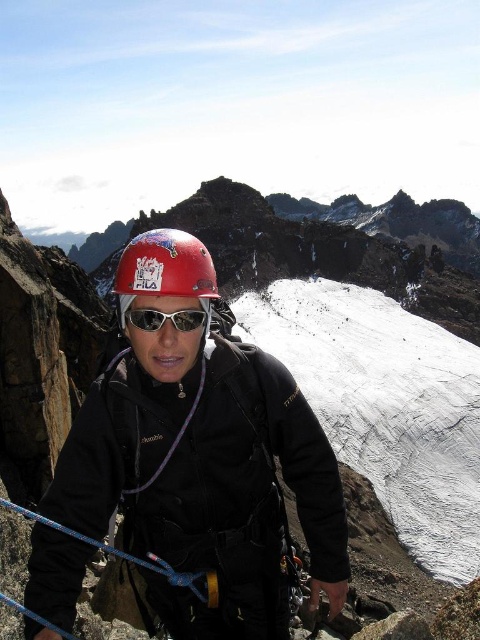
Question: Which object appears closest to the camera in this image?

Choices:
 (A) matte red helmet at center
 (B) blue synthetic rope at lower left

Answer: (B)

Question: Is matte black helmet at center positioned behind white reflective lens goggles at center?

Choices:
 (A) yes
 (B) no

Answer: (B)

Question: Is the position of matte black helmet at center less distant than that of blue synthetic rope at lower left?

Choices:
 (A) no
 (B) yes

Answer: (B)

Question: Is matte red helmet at center positioned before blue synthetic rope at lower left?

Choices:
 (A) no
 (B) yes

Answer: (A)

Question: Which point is farther to the camera?

Choices:
 (A) matte red helmet at center
 (B) white reflective lens goggles at center

Answer: (B)

Question: Which object is positioned closest to the matte black helmet at center?

Choices:
 (A) matte red helmet at center
 (B) white reflective lens goggles at center

Answer: (B)